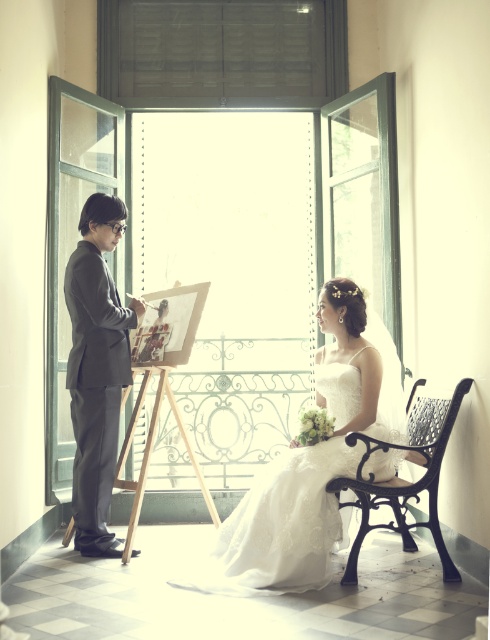
You are planning to place a rectangular table that is 2 meters wide between the white lace dress at center and the black wrought iron bench at lower right. Considering the space between them, will the table fit without overlapping either object?

The white lace dress at center is wider than the black wrought iron bench at lower right. However, the description provided does not specify the distance between the two objects, so it is impossible to determine if the table will fit without overlapping either object.

You are a photographer setting up for a photoshoot in this room. You need to position a light source between the gray suit at left and the black wrought iron bench at lower right. Based on their positions, where should you place the light source?

The gray suit at left is located above the black wrought iron bench at lower right, so the light source should be placed between them by positioning it below the gray suit at left and above the black wrought iron bench at lower right.

You are standing in the room and want to take a closer look at the gray suit at left. If you walk straight towards it, how far will you have to walk to reach it?

The gray suit at left is 15.40 feet away from the camera, so you will have to walk 15.40 feet to reach it.